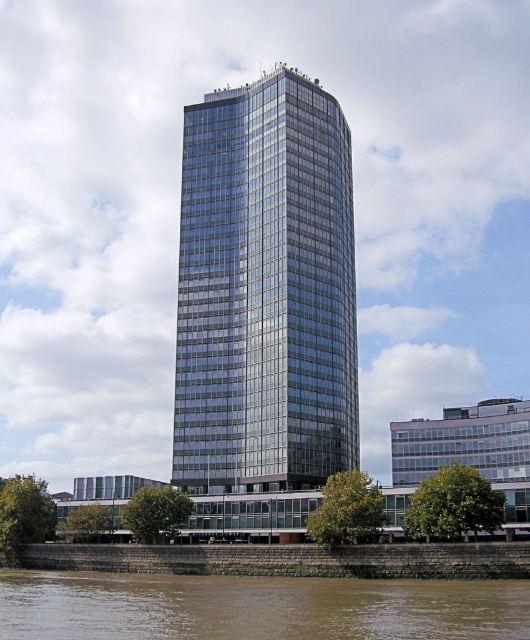
You are standing on the stone embankment and see the glassy metallic tower at center and the brown sedimentary rock at lower center. Which object is closer to your right side?

The glassy metallic tower at center is to the right of brown sedimentary rock at lower center, so it is closer to your right side.

You are a city planner reviewing the architectural blueprint of the waterfront area. You need to determine if the glassy metallic tower at center and the brown stone wall at lower left can be constructed without overlapping. Based on the image, what is your assessment?

The glassy metallic tower at center is positioned over brown stone wall at lower left, which means they would overlap if constructed as shown. Therefore, adjustments to the design are necessary to avoid overlapping structures.

Consider the image. You are an architect evaluating the structural stability of the glassy metallic tower at center and the brown sedimentary rock at lower center. Which structure has a narrower base?

The glassy metallic tower at center is thinner than the brown sedimentary rock at lower center, so the glassy metallic tower at center has a narrower base.